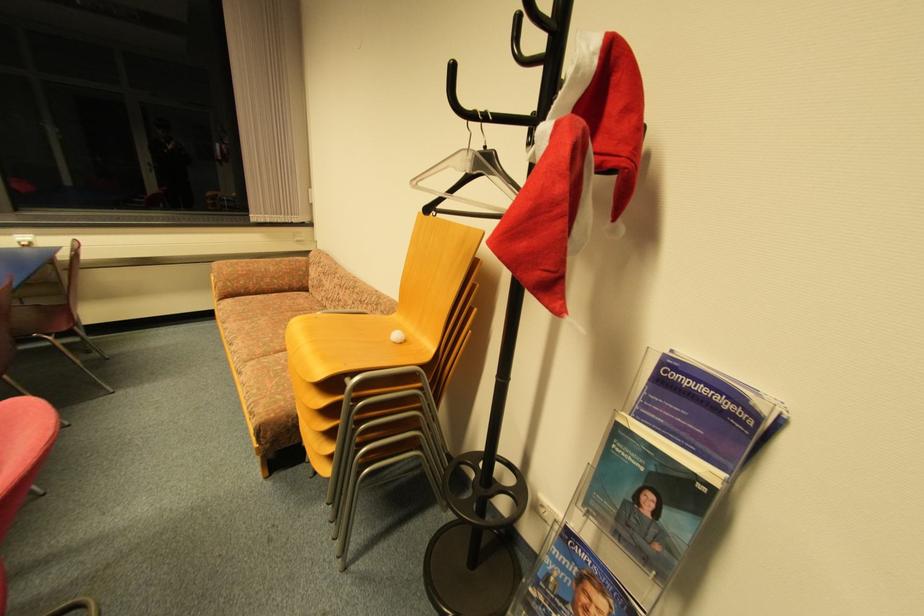
This screenshot has height=616, width=924. Describe the element at coordinates (253, 326) in the screenshot. I see `the sofa sitting surface` at that location.